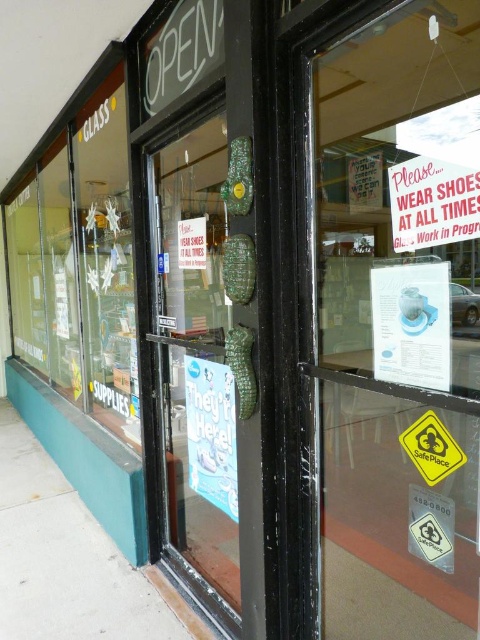
Question: Among these objects, which one is farthest from the camera?

Choices:
 (A) green textured doorknob at center
 (B) transparent glass door at center

Answer: (A)

Question: Does transparent glass door at center lie in front of white paper sign at upper right?

Choices:
 (A) no
 (B) yes

Answer: (A)

Question: Does transparent glass door at center appear on the right side of green textured doorknob at center?

Choices:
 (A) no
 (B) yes

Answer: (B)

Question: Among these objects, which one is nearest to the camera?

Choices:
 (A) transparent glass door at center
 (B) green textured doorknob at center

Answer: (A)

Question: Is transparent glass door at center further to camera compared to green textured doorknob at center?

Choices:
 (A) yes
 (B) no

Answer: (B)

Question: Estimate the real-world distances between objects in this image. Which object is closer to the transparent glass door at center?

Choices:
 (A) white paper sign at upper right
 (B) green textured doorknob at center

Answer: (A)